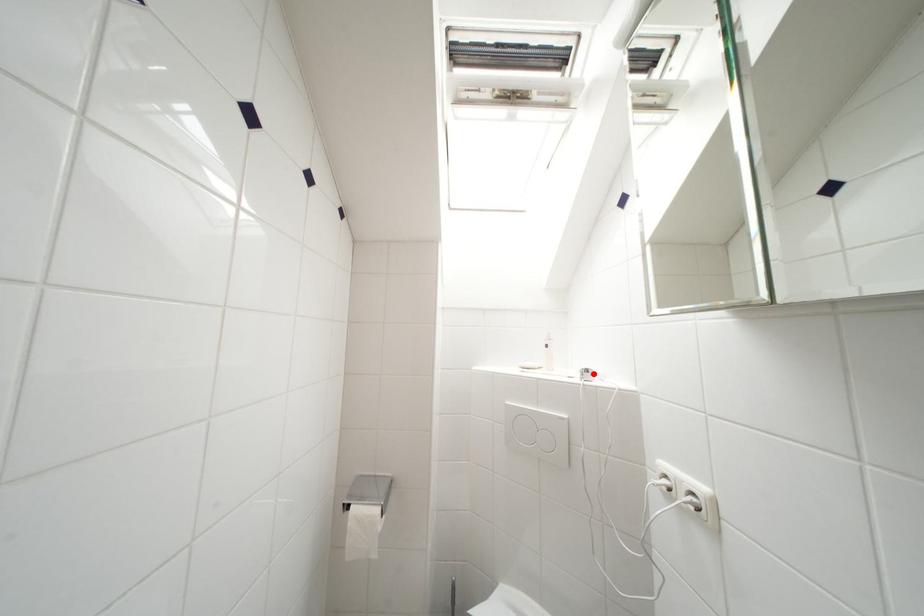
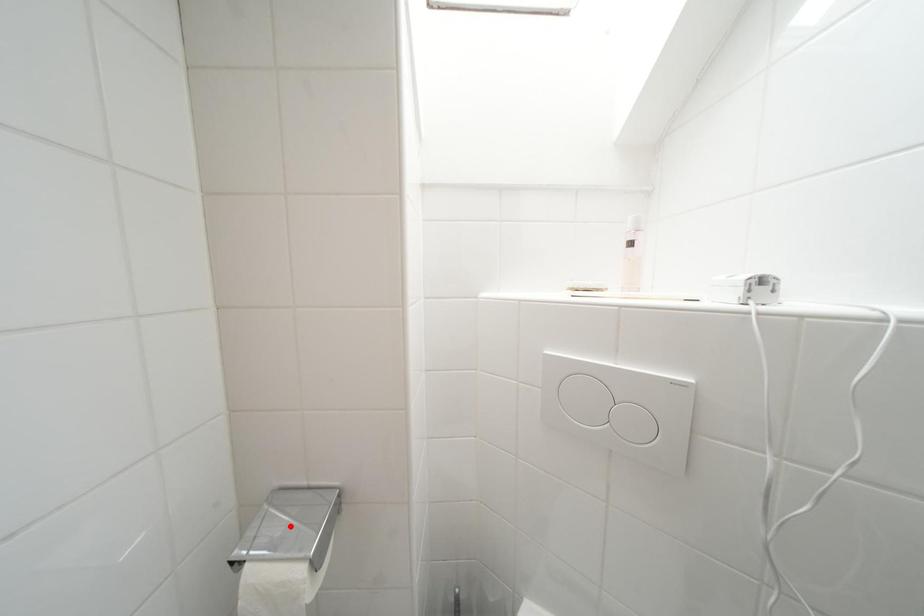
Based on the photo, I am providing you with two images of the same scene from different viewpoints. A red point is marked on the first image and another point is marked on the second image. Is the red point in image1 aligned with the point shown in image2?

No